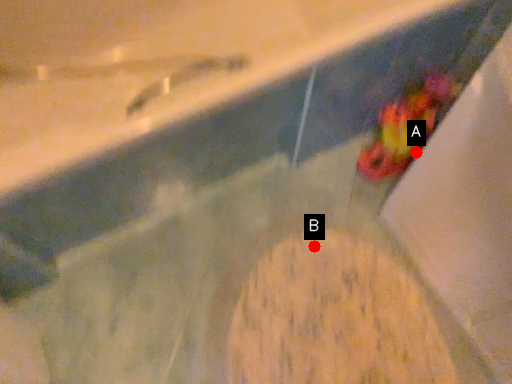
Question: Two points are circled on the image, labeled by A and B beside each circle. Which point is farther from the camera taking this photo?

Choices:
 (A) A is further
 (B) B is further

Answer: (B)